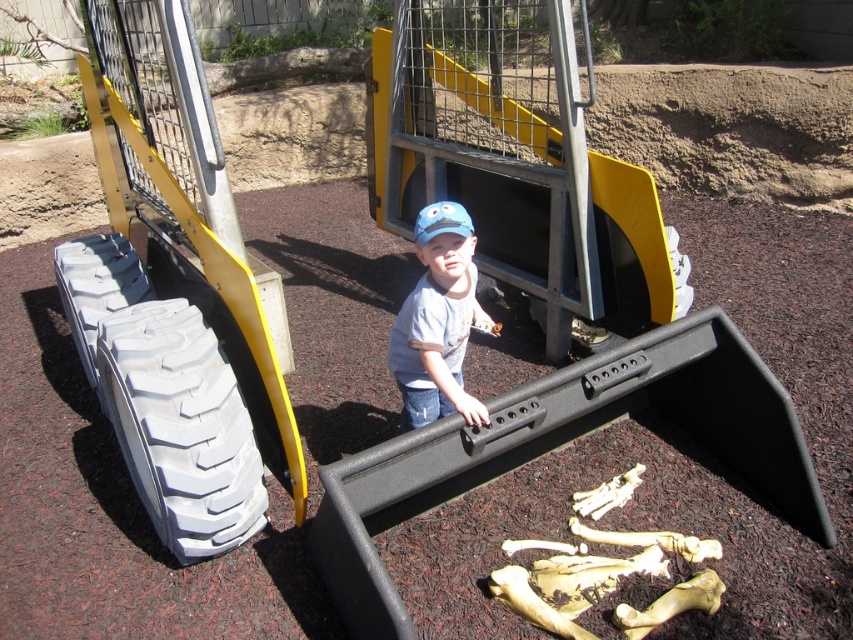
Question: Observing the image, what is the correct spatial positioning of white rubber tire at lower left in reference to gray rubber tire at lower left?

Choices:
 (A) right
 (B) left

Answer: (A)

Question: Which point is closer to the camera?

Choices:
 (A) white rubber tire at lower left
 (B) matte blue cap at center
 (C) gray rubber tire at lower left

Answer: (A)

Question: Observing the image, what is the correct spatial positioning of white rubber tire at lower left in reference to gray rubber tire at lower left?

Choices:
 (A) right
 (B) left

Answer: (A)

Question: Which point is closer to the camera?

Choices:
 (A) gray rubber tire at lower left
 (B) matte blue cap at center
 (C) white rubber tire at lower left

Answer: (C)

Question: Which point is farther to the camera?

Choices:
 (A) [234, 524]
 (B) [469, 221]

Answer: (A)

Question: Where is white rubber tire at lower left located in relation to matte blue cap at center in the image?

Choices:
 (A) left
 (B) right

Answer: (A)